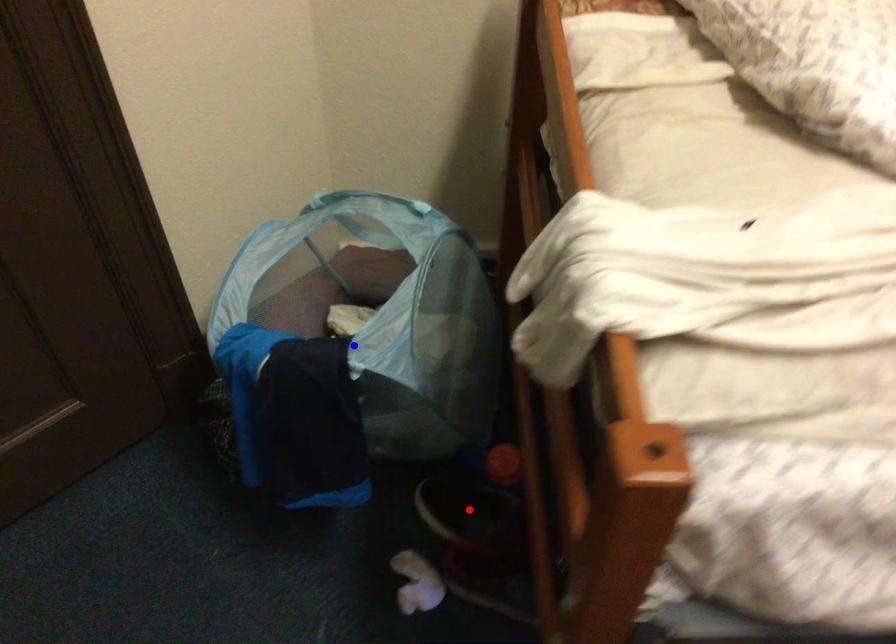
Question: In the image, two points are highlighted. Which point is nearer to the camera? Reply with the corresponding letter.

Choices:
 (A) blue point
 (B) red point

Answer: (A)